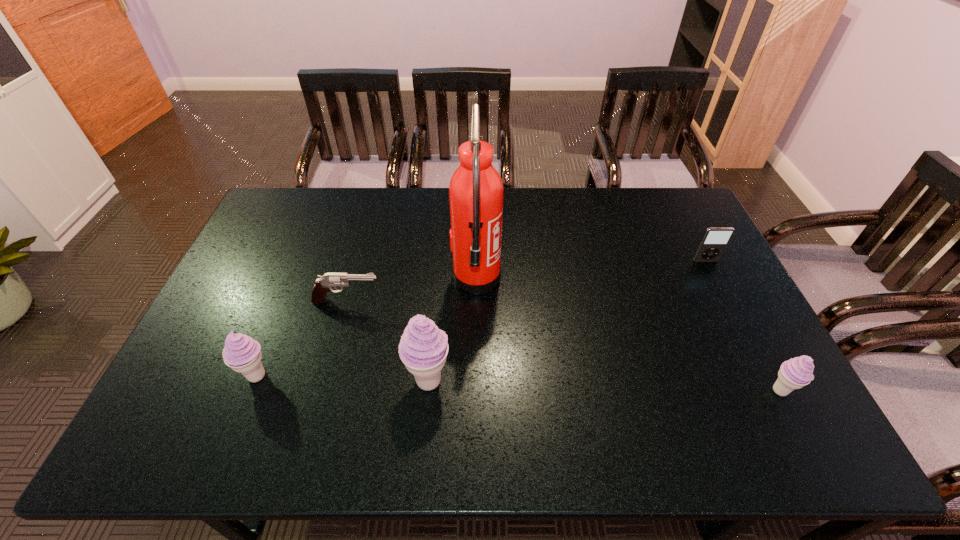
This screenshot has width=960, height=540. Find the location of `free space at the near edge of the desktop`. free space at the near edge of the desktop is located at coordinates pyautogui.click(x=479, y=394).

Identify the location of free point at the left edge. The height and width of the screenshot is (540, 960). (228, 280).

I want to click on free space at the right edge, so click(691, 253).

The width and height of the screenshot is (960, 540). In the image, there is a desktop. In order to click on vacant space at the far right corner in this screenshot , I will do `click(677, 219)`.

This screenshot has height=540, width=960. I want to click on unoccupied area between the iPod and the rightmost icecream, so click(x=742, y=326).

Locate an element on the screen. free space between the fire extinguisher and the leftmost icecream is located at coordinates (367, 328).

Identify the location of vacant area that lies between the gun and the iPod. (526, 281).

This screenshot has height=540, width=960. Identify the location of vacant point located between the third tallest object and the iPod. (481, 319).

Find the location of a particular element. Image resolution: width=960 pixels, height=540 pixels. vacant region between the third tallest object and the second icecream from right to left is located at coordinates (343, 379).

This screenshot has height=540, width=960. I want to click on vacant area between the shortest icecream and the tallest object, so click(628, 335).